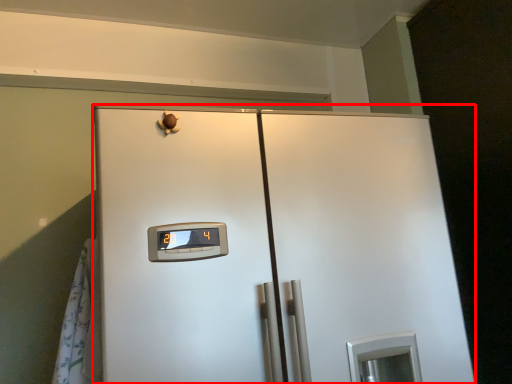
Question: From the image's perspective, where is refrigerator (annotated by the red box) located in relation to curtain in the image?

Choices:
 (A) above
 (B) below

Answer: (B)